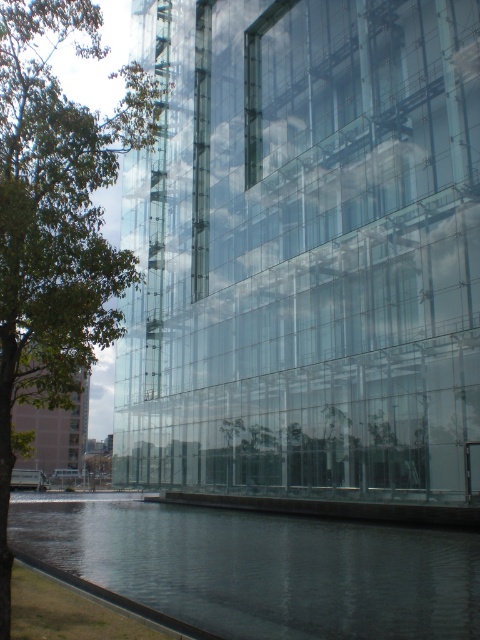
You are standing in front of the modern building and notice the transparent glass water at lower left and the green leafy tree at left. Which object appears smaller in the image?

The transparent glass water at lower left appears smaller compared to the green leafy tree at left.

You are standing at the center of the image and want to walk towards the transparent glass water at lower left. Which direction should you move in?

Since the transparent glass water at lower left is located at point (262, 566), you should move towards the lower left direction to reach it.